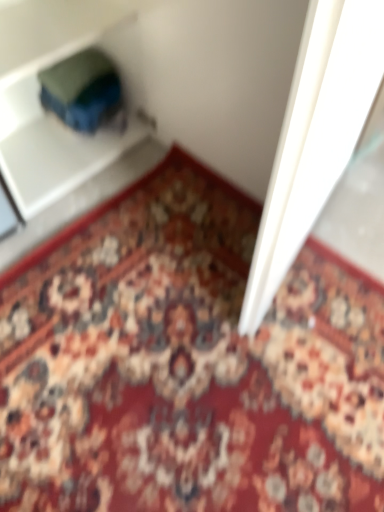
Find the location of a particular element. vacant space in floral carpet at center (from a real-world perspective) is located at coordinates (183, 349).